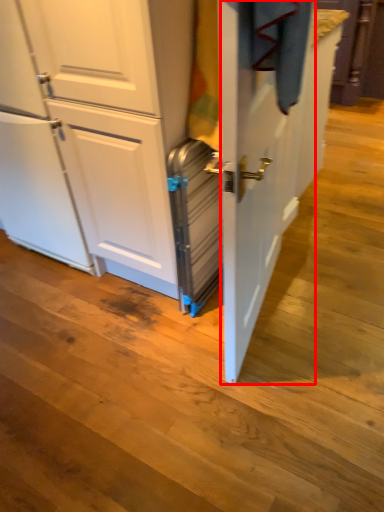
Question: From the image's perspective, where is screen door (annotated by the red box) located relative to appliance?

Choices:
 (A) below
 (B) above

Answer: (B)